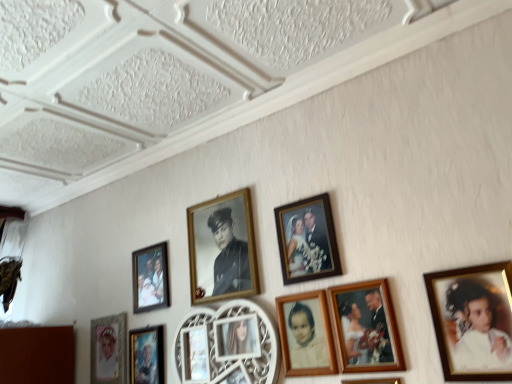
Question: From a real-world perspective, is wooden photo frame at center, which ranks as the 2th picture frame in right-to-left order, positioned over metallic silver portrait at lower left, arranged as the third picture frame when viewed from the left, based on gravity?

Choices:
 (A) no
 (B) yes

Answer: (B)

Question: Considering the relative sizes of wooden photo frame at center, which ranks as the 2th picture frame in right-to-left order, and metallic silver portrait at lower left, arranged as the third picture frame when viewed from the left, in the image provided, is wooden photo frame at center, which ranks as the 2th picture frame in right-to-left order, wider than metallic silver portrait at lower left, arranged as the third picture frame when viewed from the left,?

Choices:
 (A) no
 (B) yes

Answer: (A)

Question: Is the depth of wooden photo frame at center, which ranks as the 2th picture frame in right-to-left order, greater than that of metallic silver portrait at lower left, the sixth picture frame when ordered from right to left?

Choices:
 (A) no
 (B) yes

Answer: (A)

Question: From the image's perspective, would you say wooden photo frame at center, which is the 7th picture frame in left-to-right order, is shown under metallic silver portrait at lower left, arranged as the third picture frame when viewed from the left?

Choices:
 (A) no
 (B) yes

Answer: (A)

Question: Is wooden photo frame at center, which ranks as the 2th picture frame in right-to-left order, aimed at metallic silver portrait at lower left, the sixth picture frame when ordered from right to left?

Choices:
 (A) yes
 (B) no

Answer: (B)

Question: Considering the relative sizes of wooden photo frame at center, which ranks as the 2th picture frame in right-to-left order, and metallic silver portrait at lower left, arranged as the third picture frame when viewed from the left, in the image provided, is wooden photo frame at center, which ranks as the 2th picture frame in right-to-left order, taller than metallic silver portrait at lower left, arranged as the third picture frame when viewed from the left,?

Choices:
 (A) yes
 (B) no

Answer: (B)

Question: Can matte gold frame at upper right be found inside metallic silver portrait at lower left, the sixth picture frame when ordered from right to left?

Choices:
 (A) no
 (B) yes

Answer: (A)

Question: Can you confirm if metallic silver portrait at lower left, the sixth picture frame when ordered from right to left, is thinner than matte gold frame at upper right?

Choices:
 (A) no
 (B) yes

Answer: (A)

Question: Is metallic silver portrait at lower left, arranged as the third picture frame when viewed from the left, positioned with its back to matte gold frame at upper right?

Choices:
 (A) yes
 (B) no

Answer: (B)

Question: Can you confirm if metallic silver portrait at lower left, arranged as the third picture frame when viewed from the left, is positioned to the left of matte gold frame at upper right?

Choices:
 (A) yes
 (B) no

Answer: (A)

Question: Are metallic silver portrait at lower left, arranged as the third picture frame when viewed from the left, and matte gold frame at upper right located far from each other?

Choices:
 (A) yes
 (B) no

Answer: (B)

Question: Are metallic silver portrait at lower left, arranged as the third picture frame when viewed from the left, and matte gold frame at upper right making contact?

Choices:
 (A) yes
 (B) no

Answer: (B)

Question: Does wooden photo frame at lower center, the 8th picture frame viewed from the left, have a lesser width compared to matte gold picture frame at lower left, marked as the eighth picture frame in a right-to-left arrangement?

Choices:
 (A) yes
 (B) no

Answer: (A)